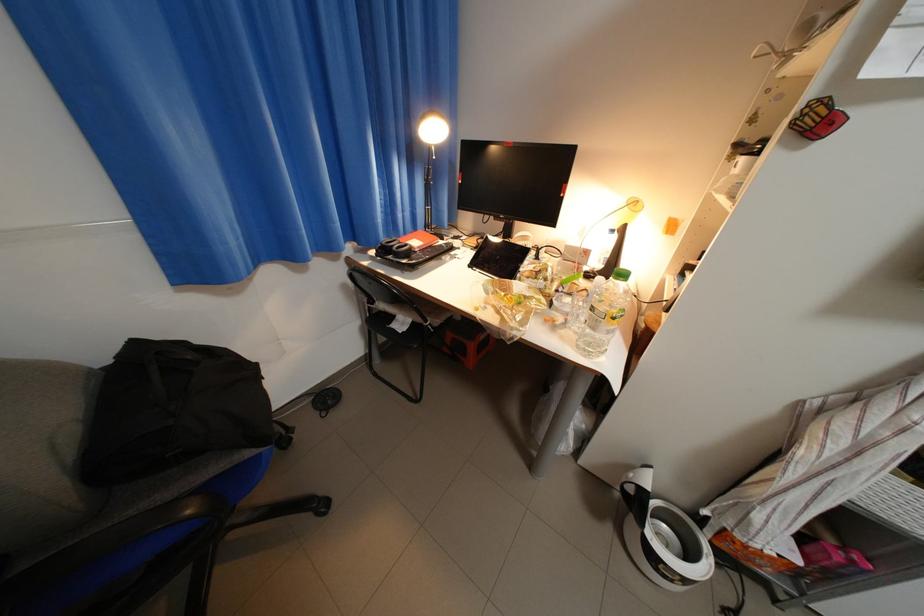
The location [172,410] corresponds to which object?

This point indicates the black bag.